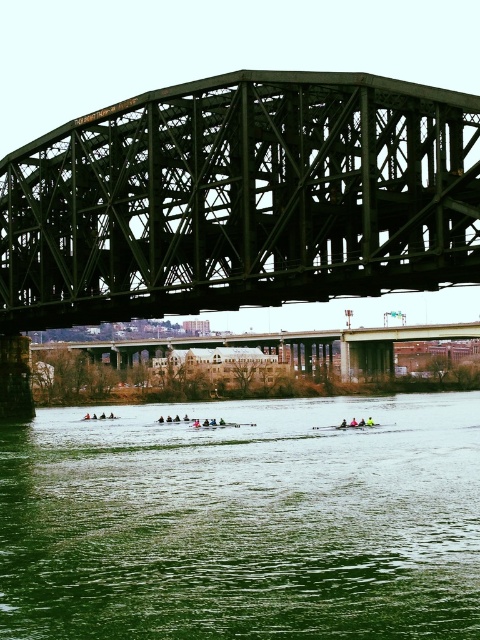
You are a photographer planning to take a photo of the green steel bridge at center and the green water at lower center. Since both objects are green, how can you ensure they are distinguishable in your photo?

The green water at lower center is positioned under the green steel bridge at center, so you can distinguish them by their spatial relationship where the water is below the bridge.

You are a photographer planning to capture the entire scene of the green steel bridge at center and the green water at lower center in one shot. Based on their sizes, which object should you focus on to ensure both are clearly visible in your photo?

The green water at lower center is larger in size than the green steel bridge at center, so focusing on the green water at lower center will help ensure both objects are clearly visible in the photo.